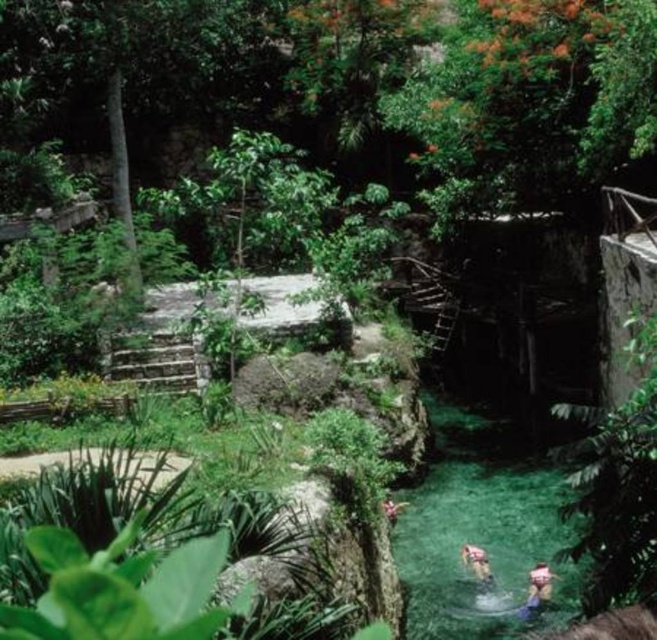
Can you confirm if green leafy plant at lower right is thinner than yellow-green fabric at lower right?

Incorrect, green leafy plant at lower right's width is not less than yellow-green fabric at lower right's.

Measure the distance between point (x=616, y=429) and camera.

They are 6.74 meters apart.

Does point (627, 474) come farther from viewer compared to point (549, 584)?

That is False.

Identify the location of green leafy plant at lower right. (616, 484).

Is green leafy plant at lower right bigger than yellow fabric person at lower center?

Correct, green leafy plant at lower right is larger in size than yellow fabric person at lower center.

Is green leafy plant at lower right thinner than yellow fabric person at lower center?

No.

At what (x,y) coordinates should I click in order to perform the action: click on green leafy plant at lower right. Please return your answer as a coordinate pair (x, y). This screenshot has height=640, width=657. Looking at the image, I should click on (616, 484).

Identify the location of green leafy plant at lower right. (616, 484).

Does yellow-green fabric at lower right have a greater width compared to yellow fabric person at lower center?

No, yellow-green fabric at lower right is not wider than yellow fabric person at lower center.

Who is higher up, yellow-green fabric at lower right or yellow fabric person at lower center?

yellow fabric person at lower center is higher up.

This screenshot has height=640, width=657. I want to click on yellow-green fabric at lower right, so click(x=537, y=588).